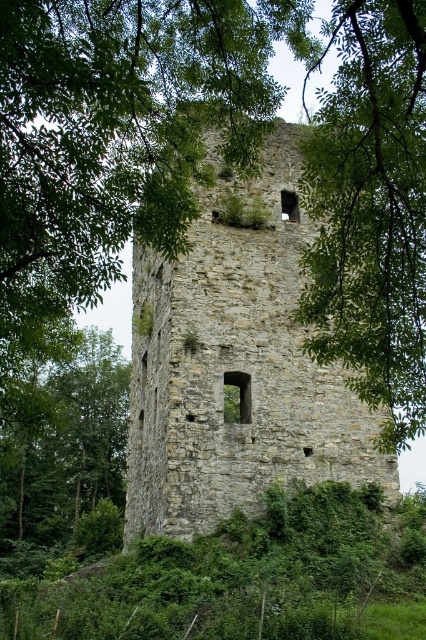
Question: Can you confirm if stone tower at center is wider than green leafy tree at left?

Choices:
 (A) yes
 (B) no

Answer: (A)

Question: Where is stone tower at center located in relation to green leafy tree at left in the image?

Choices:
 (A) right
 (B) left

Answer: (A)

Question: Is stone tower at center thinner than green leafy tree at left?

Choices:
 (A) yes
 (B) no

Answer: (B)

Question: Among these objects, which one is farthest from the camera?

Choices:
 (A) stone tower at center
 (B) green leafy tree at left

Answer: (A)